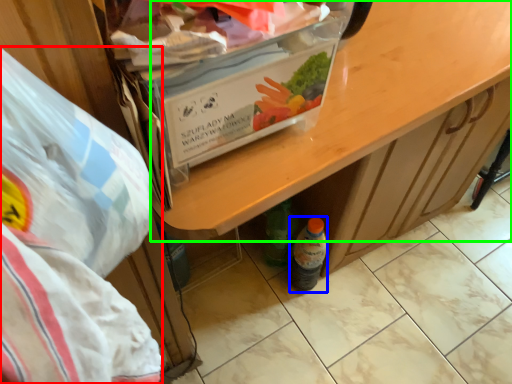
Question: Based on their relative distances, which object is nearer to waste (highlighted by a red box)? Choose from bottle (highlighted by a blue box) and desk (highlighted by a green box).

Choices:
 (A) bottle
 (B) desk

Answer: (B)